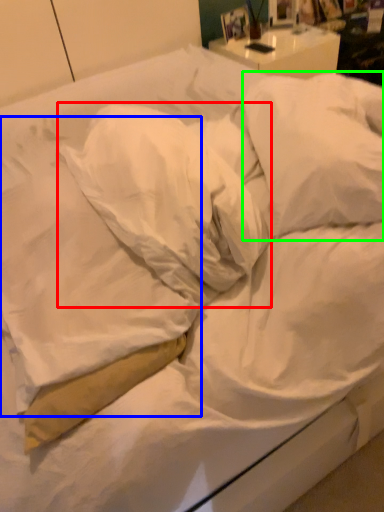
Question: Which is farther away from pillow (highlighted by a red box)? pillow (highlighted by a blue box) or pillow (highlighted by a green box)?

Choices:
 (A) pillow
 (B) pillow

Answer: (B)